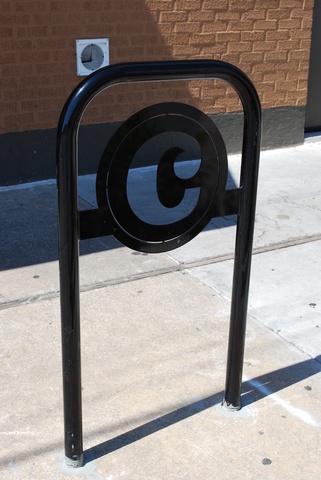
You are a GUI agent. You are given a task and a screenshot of the screen. Output one action in this format:
    pyautogui.click(x=<x>, y=<y>)
    Task: Click on the divider
    This screenshot has width=321, height=480.
    Given the screenshot: What is the action you would take?
    pyautogui.click(x=115, y=283)